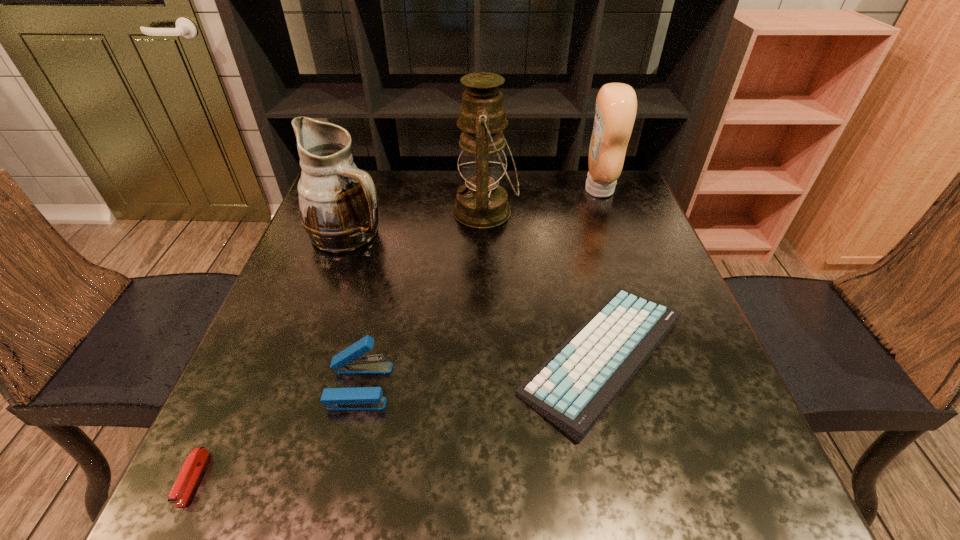
This screenshot has width=960, height=540. Identify the location of vacant space located 0.400m on the label of the condiment. (444, 190).

Locate an element on the screen. free location located on the label of the condiment is located at coordinates (531, 190).

At what (x,y) coordinates should I click in order to perform the action: click on vacant space located 0.170m from the spout of the pitcher. Please return your answer as a coordinate pair (x, y). Image resolution: width=960 pixels, height=540 pixels. Looking at the image, I should click on (458, 233).

Locate an element on the screen. vacant area located 0.140m on the front of the taller stapler is located at coordinates (334, 496).

This screenshot has height=540, width=960. I want to click on vacant area situated 0.240m on the left of the computer keyboard, so click(388, 356).

Locate an element on the screen. The width and height of the screenshot is (960, 540). oil lamp that is at the far edge is located at coordinates (481, 202).

Locate an element on the screen. condiment that is at the far edge is located at coordinates (616, 104).

This screenshot has height=540, width=960. In order to click on pitcher present at the far edge in this screenshot , I will do `click(338, 202)`.

Find the location of a particular element. Image resolution: width=960 pixels, height=540 pixels. object that is at the near edge is located at coordinates (190, 471).

At what (x,y) coordinates should I click in order to perform the action: click on pitcher present at the left edge. Please return your answer as a coordinate pair (x, y). The width and height of the screenshot is (960, 540). Looking at the image, I should click on (338, 202).